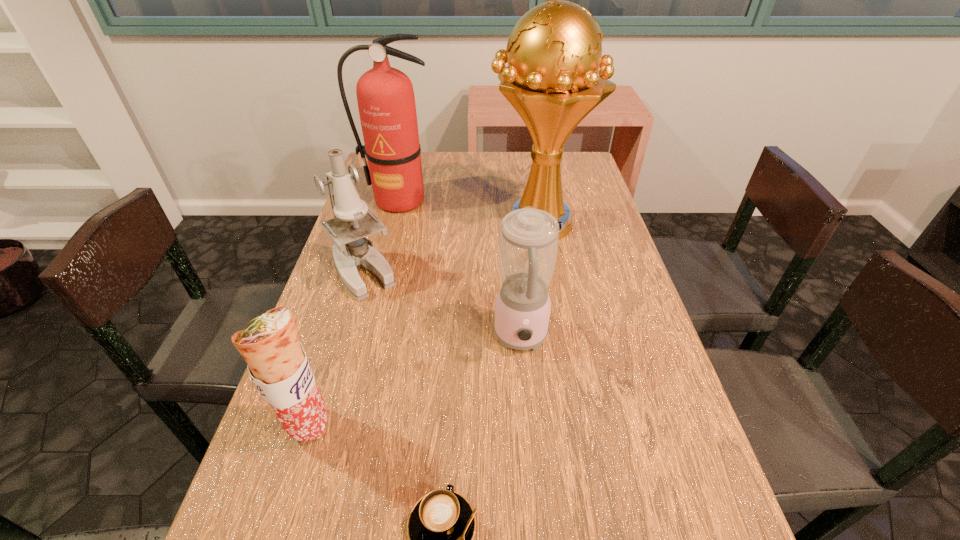
Find the location of `vacant area situated 0.090m on the base of the food processor near the control knob`. vacant area situated 0.090m on the base of the food processor near the control knob is located at coordinates (527, 404).

This screenshot has width=960, height=540. In order to click on free space located on the right of the burrito in this screenshot , I will do `click(499, 425)`.

The height and width of the screenshot is (540, 960). Find the location of `fire extinguisher that is at the left edge`. fire extinguisher that is at the left edge is located at coordinates (385, 96).

Locate an element on the screen. The height and width of the screenshot is (540, 960). microscope that is at the left edge is located at coordinates (353, 221).

In order to click on burrito located in the left edge section of the desktop in this screenshot , I will do `click(277, 363)`.

Where is `object that is at the right edge`? object that is at the right edge is located at coordinates (554, 52).

At what (x,y) coordinates should I click in order to perform the action: click on free space at the far edge of the desktop. Please return your answer as a coordinate pair (x, y). The image size is (960, 540). Looking at the image, I should click on (422, 167).

Find the location of `free point at the left edge`. free point at the left edge is located at coordinates tap(339, 464).

Where is `free space at the right edge`? The image size is (960, 540). free space at the right edge is located at coordinates (614, 232).

Locate an element on the screen. blank space at the far right corner of the desktop is located at coordinates [x=588, y=177].